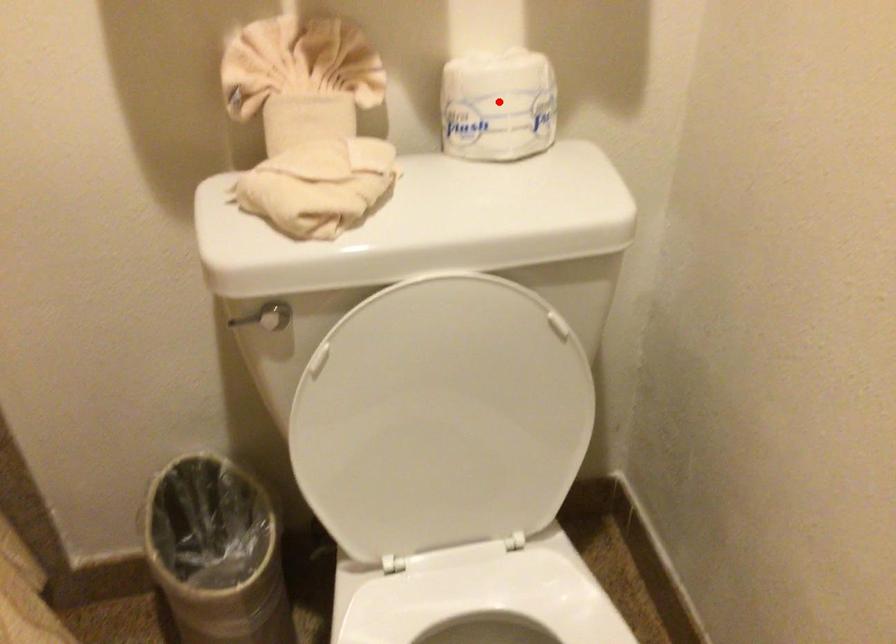
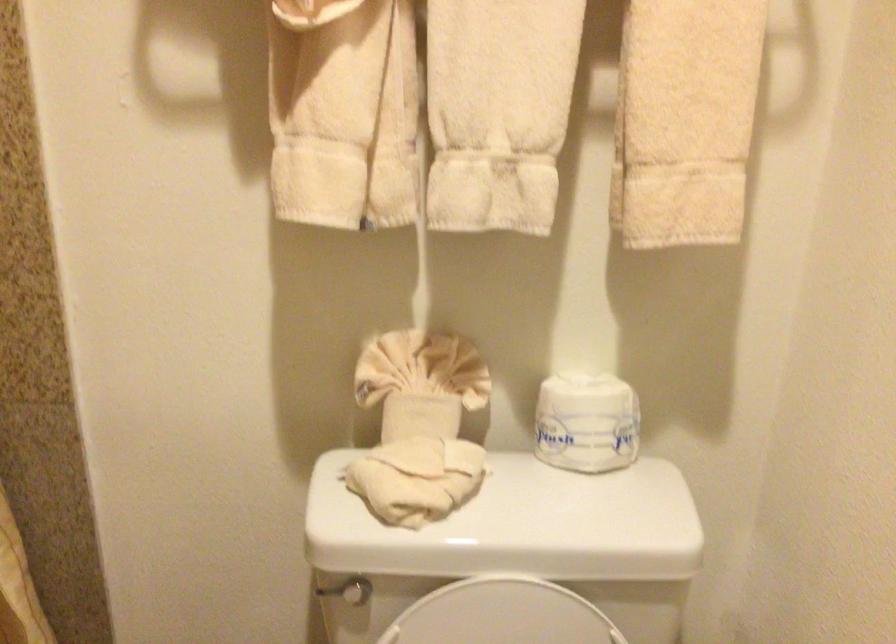
Question: A red point is marked in image1. In image2, is the corresponding 3D point closer to the camera or farther? Reply with the corresponding letter.

Choices:
 (A) The corresponding 3D point is closer.
 (B) The corresponding 3D point is farther.

Answer: (B)